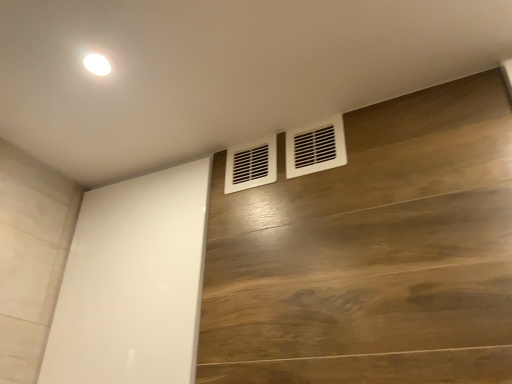
Question: From the image's perspective, is white plastic vent at upper right, which is counted as the second air conditioning, starting from the left, located beneath white matte vent at center, arranged as the first air conditioning when viewed from the left?

Choices:
 (A) no
 (B) yes

Answer: (A)

Question: Is white plastic vent at upper right, which is counted as the second air conditioning, starting from the left, taller than white matte vent at center, arranged as the first air conditioning when viewed from the left?

Choices:
 (A) no
 (B) yes

Answer: (B)

Question: From the image's perspective, is white plastic vent at upper right, the first air conditioning when ordered from right to left, on top of white matte vent at center, arranged as the first air conditioning when viewed from the left?

Choices:
 (A) yes
 (B) no

Answer: (A)

Question: Does white plastic vent at upper right, the first air conditioning when ordered from right to left, appear on the left side of white matte vent at center, arranged as the first air conditioning when viewed from the left?

Choices:
 (A) yes
 (B) no

Answer: (B)

Question: Considering the relative positions of white plastic vent at upper right, the first air conditioning when ordered from right to left, and white matte vent at center, arranged as the first air conditioning when viewed from the left, in the image provided, is white plastic vent at upper right, the first air conditioning when ordered from right to left, to the right of white matte vent at center, arranged as the first air conditioning when viewed from the left, from the viewer's perspective?

Choices:
 (A) no
 (B) yes

Answer: (B)

Question: Is the depth of white plastic vent at upper right, which is counted as the second air conditioning, starting from the left, less than that of white matte vent at center, the second air conditioning viewed from the right?

Choices:
 (A) no
 (B) yes

Answer: (B)

Question: Is white matte vent at center, arranged as the first air conditioning when viewed from the left, far away from white glossy screen door at center?

Choices:
 (A) no
 (B) yes

Answer: (A)

Question: Is white matte vent at center, arranged as the first air conditioning when viewed from the left, outside of white glossy screen door at center?

Choices:
 (A) yes
 (B) no

Answer: (A)

Question: Is white matte vent at center, arranged as the first air conditioning when viewed from the left, to the left of white glossy screen door at center from the viewer's perspective?

Choices:
 (A) no
 (B) yes

Answer: (A)

Question: From a real-world perspective, is white matte vent at center, the second air conditioning viewed from the right, on top of white glossy screen door at center?

Choices:
 (A) yes
 (B) no

Answer: (A)

Question: Does white matte vent at center, the second air conditioning viewed from the right, have a smaller size compared to white glossy screen door at center?

Choices:
 (A) yes
 (B) no

Answer: (A)

Question: From a real-world perspective, is white matte vent at center, arranged as the first air conditioning when viewed from the left, beneath white glossy screen door at center?

Choices:
 (A) no
 (B) yes

Answer: (A)

Question: Does white matte vent at center, arranged as the first air conditioning when viewed from the left, have a lesser width compared to white plastic vent at upper right, the first air conditioning when ordered from right to left?

Choices:
 (A) yes
 (B) no

Answer: (A)